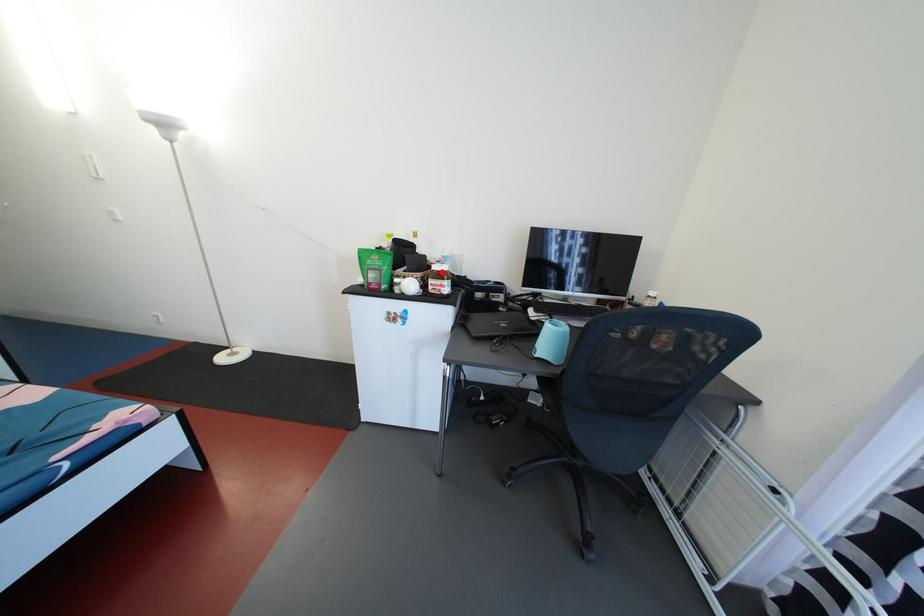
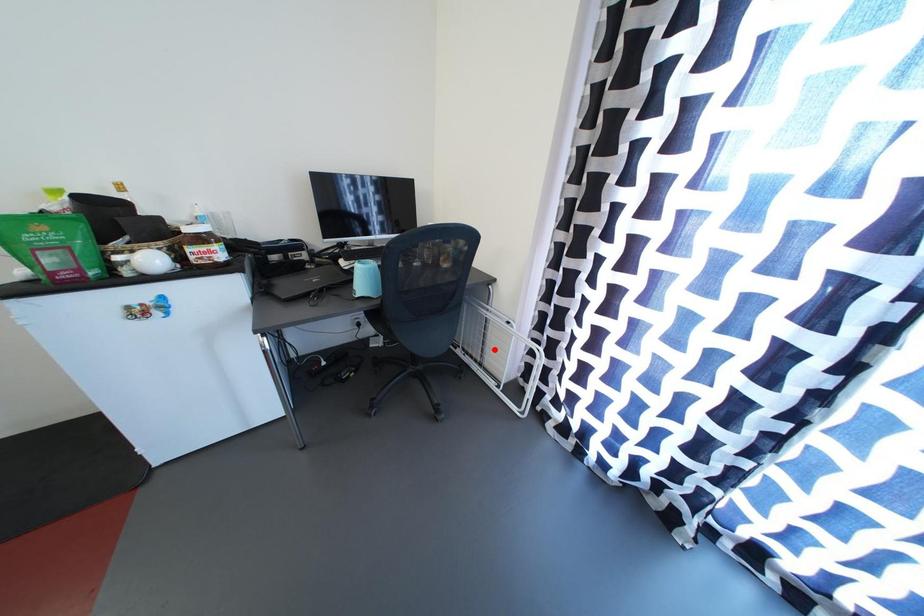
I am providing you with two images of the same scene from different viewpoints. A red point is marked on the first image and another point is marked on the second image. Are the points marked in image1 and image2 representing the same 3D position?

No